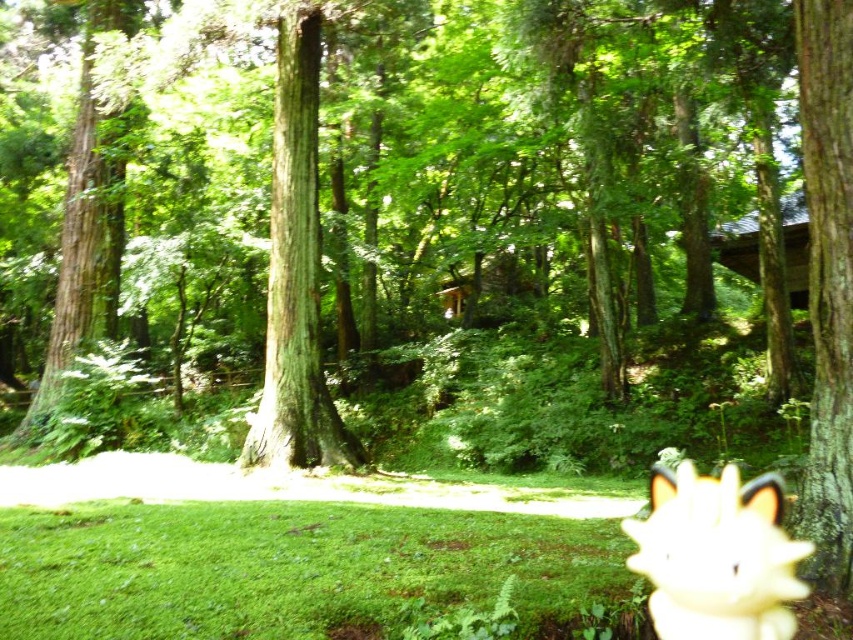
You are a hiker who wants to take a photo of the green rough bark tree at right and the white fluffy dog at lower right together in the same frame. Based on the scene, will both fit in your camera viewfinder if you stand at the edge of the forest path? Explain your reasoning.

The green rough bark tree at right and white fluffy dog at lower right are 1.30 meters apart. Since the distance between them is relatively small, you can likely fit both into the camera viewfinder by adjusting your position to ensure they are within the frame.

You are standing in the forest scene and want to walk from the point at coordinates point [848,262] to the point at coordinates point [688,509]. Which direction should you face to move towards the second point?

Since point [848,262] is behind point [688,509], you should face towards the front direction to move towards the second point.